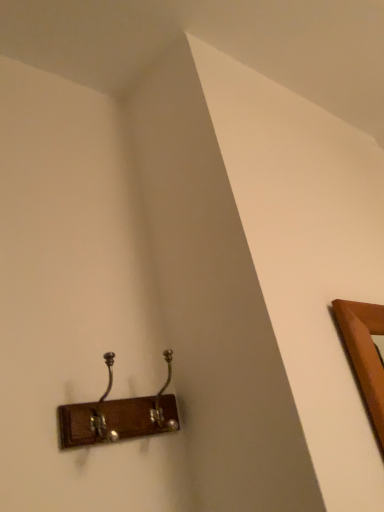
The width and height of the screenshot is (384, 512). What do you see at coordinates (118, 415) in the screenshot?
I see `polished brass hooks at lower center` at bounding box center [118, 415].

Locate an element on the screen. polished brass hooks at lower center is located at coordinates (118, 415).

Locate an element on the screen. polished brass hooks at lower center is located at coordinates (118, 415).